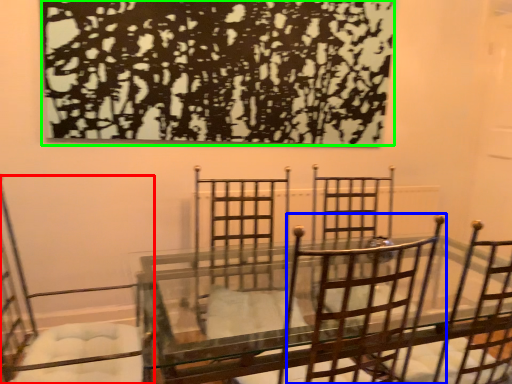
Question: Which object is positioned farthest from chair (highlighted by a red box)? Select from chair (highlighted by a blue box) and tree (highlighted by a green box).

Choices:
 (A) chair
 (B) tree

Answer: (A)